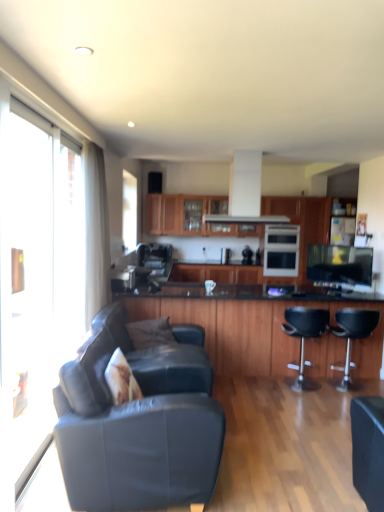
Locate an element on the screen. This screenshot has width=384, height=512. free location to the right of leather couch at lower left is located at coordinates (269, 463).